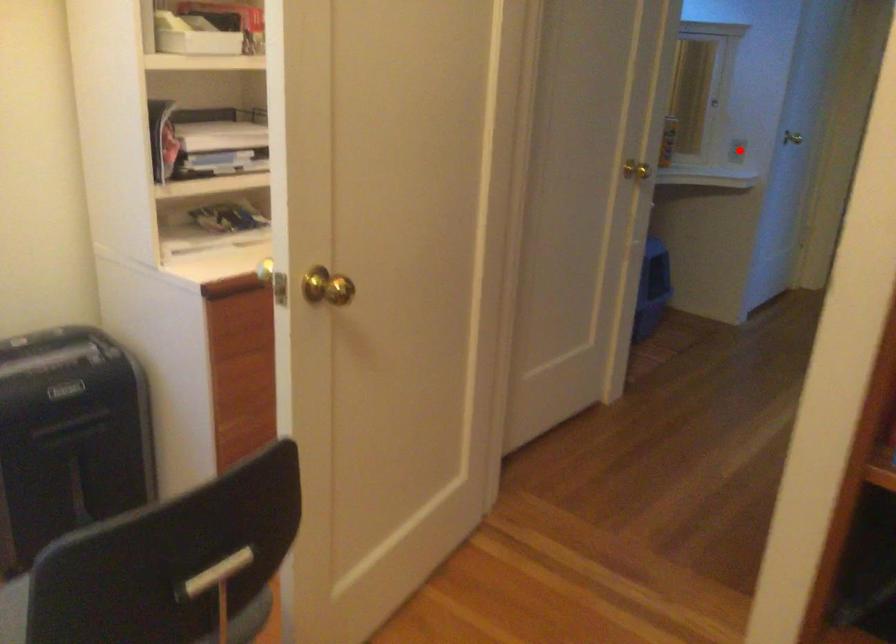
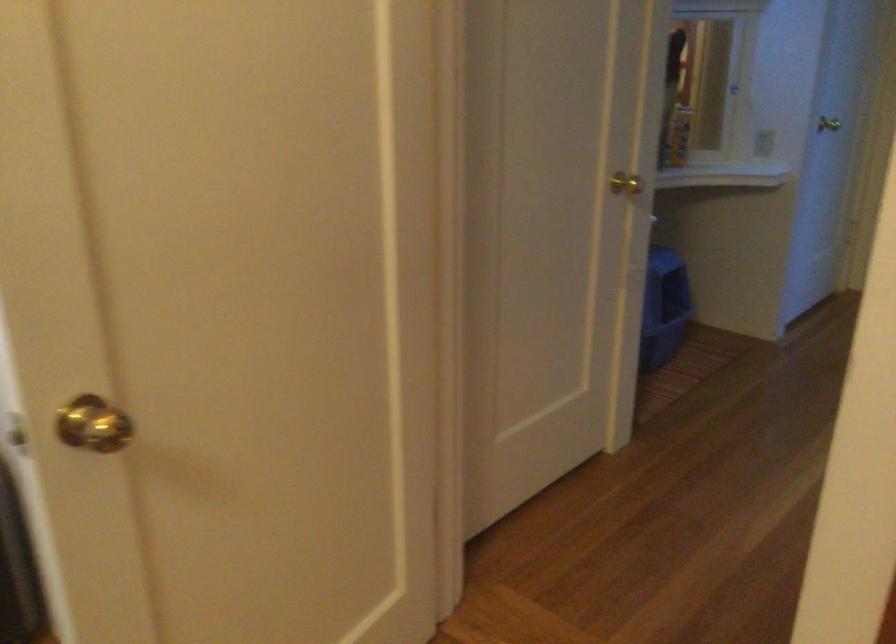
Question: I am providing you with two images of the same scene from different viewpoints. In image1, a red point is highlighted. Considering the same 3D point in image2, which of the following is correct?

Choices:
 (A) It is closer
 (B) It is farther

Answer: (A)